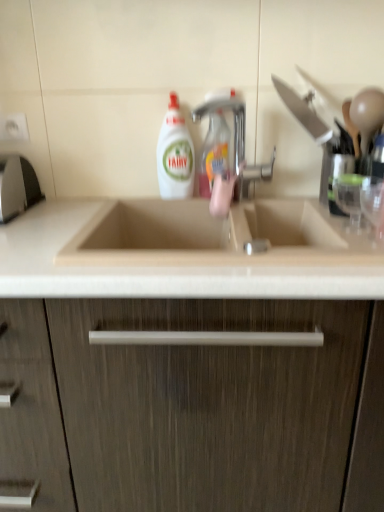
Question: Is point (185, 167) positioned closer to the camera than point (97, 508)?

Choices:
 (A) farther
 (B) closer

Answer: (A)

Question: Considering the positions of white glossy liquid at center, the 1th cleaning product positioned from the left, and beige wood cabinet at center in the image, is white glossy liquid at center, the 1th cleaning product positioned from the left, taller or shorter than beige wood cabinet at center?

Choices:
 (A) tall
 (B) short

Answer: (B)

Question: Estimate the real-world distances between objects in this image. Which object is closer to the white glossy liquid at center, the 1th cleaning product positioned from the left?

Choices:
 (A) beige marble countertop at center
 (B) white plastic electric outlet at upper left
 (C) beige wood cabinet at center
 (D) translucent plastic spray bottle at center, which is counted as the second cleaning product, starting from the left
 (E) silver metallic faucet at center

Answer: (D)

Question: Estimate the real-world distances between objects in this image. Which object is closer to the white plastic electric outlet at upper left?

Choices:
 (A) white glossy liquid at center, the 1th cleaning product positioned from the left
 (B) translucent plastic spray bottle at center, the first cleaning product positioned from the right
 (C) beige wood cabinet at center
 (D) silver metallic faucet at center
 (E) beige marble countertop at center

Answer: (A)